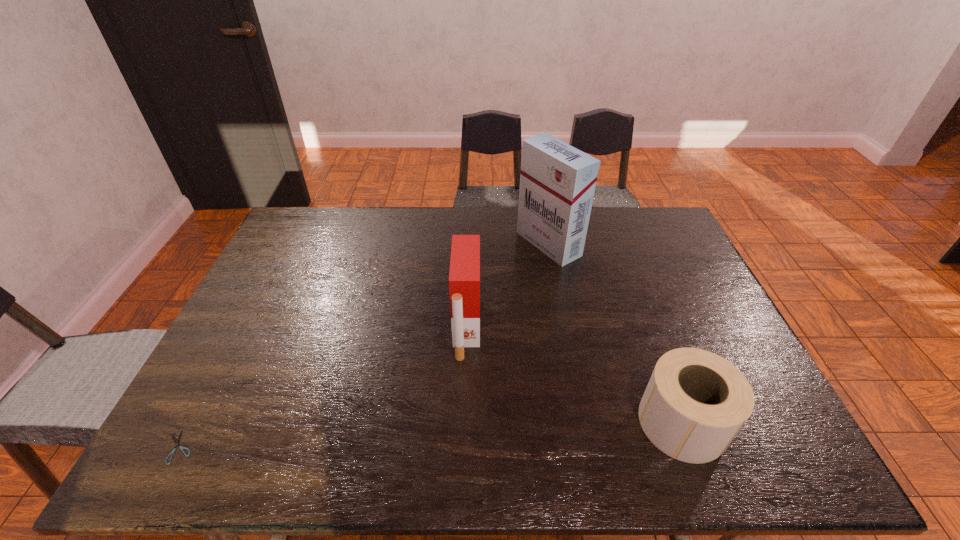
Where is `vacant space located 0.280m on the left of the rightmost object`? vacant space located 0.280m on the left of the rightmost object is located at coordinates (520, 422).

Where is `free space located on the back of the shortest object`? Image resolution: width=960 pixels, height=540 pixels. free space located on the back of the shortest object is located at coordinates click(207, 393).

Identify the location of object at the far edge. This screenshot has width=960, height=540. (557, 181).

Identify the location of toilet tissue present at the near edge. Image resolution: width=960 pixels, height=540 pixels. (695, 403).

Where is `shears present at the near edge`? shears present at the near edge is located at coordinates (176, 442).

Where is `object at the left edge`? This screenshot has height=540, width=960. object at the left edge is located at coordinates (176, 442).

At what (x,y) coordinates should I click in order to perform the action: click on object located in the right edge section of the desktop. Please return your answer as a coordinate pair (x, y). The height and width of the screenshot is (540, 960). Looking at the image, I should click on (695, 403).

Where is `object located at the near left corner`? The image size is (960, 540). object located at the near left corner is located at coordinates (176, 442).

Where is `object that is at the near right corner`? Image resolution: width=960 pixels, height=540 pixels. object that is at the near right corner is located at coordinates (695, 403).

Find the location of `vacant space at the far edge of the desktop`. vacant space at the far edge of the desktop is located at coordinates (448, 242).